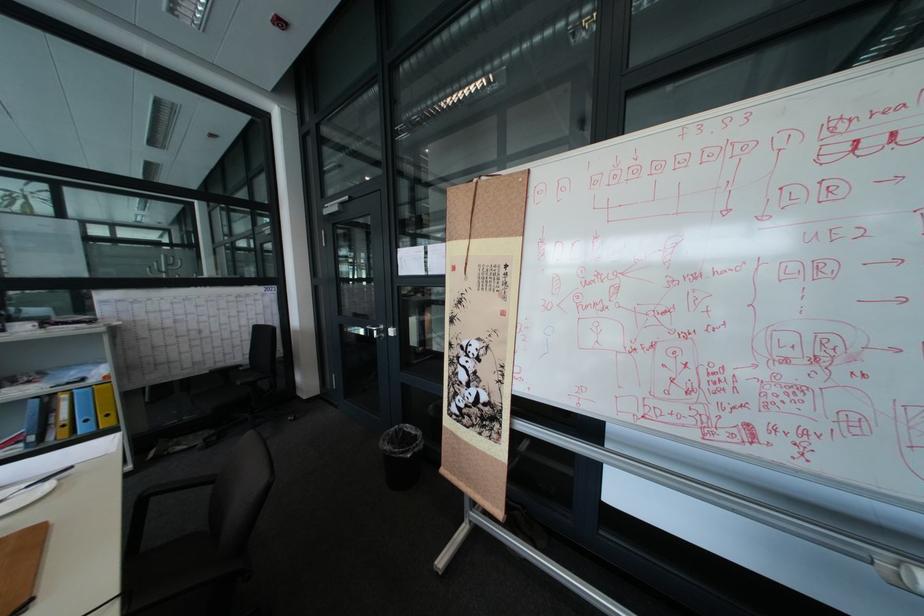
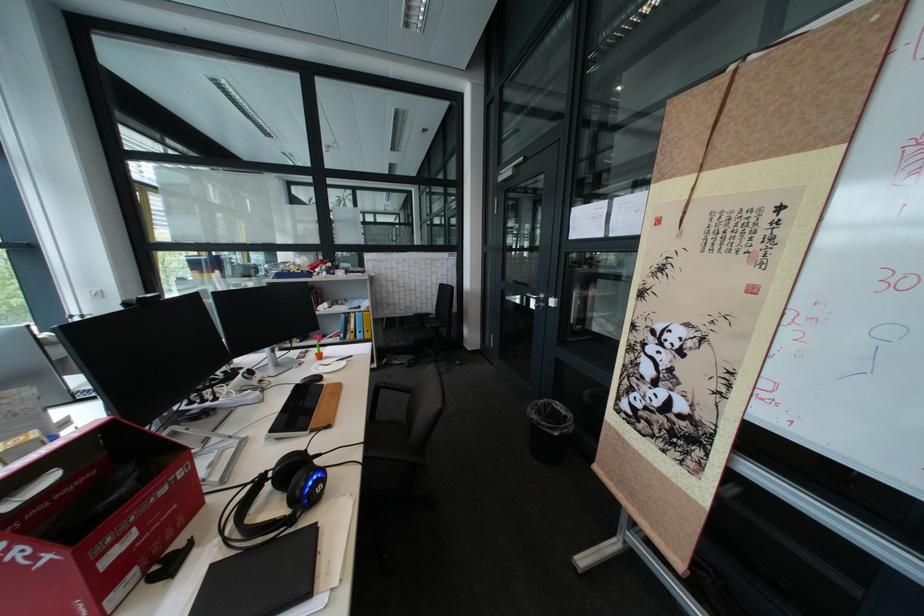
The point at (146, 589) is marked in the first image. Where is the corresponding point in the second image?

(382, 443)